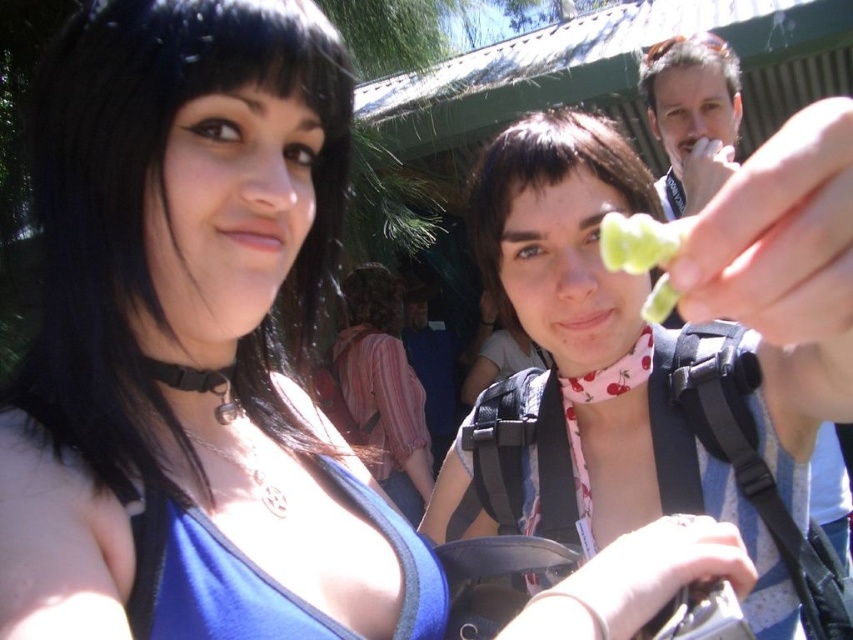
Question: Observing the image, what is the correct spatial positioning of translucent plastic gummy bear at center in reference to green leafy vegetable at center?

Choices:
 (A) below
 (B) above

Answer: (A)

Question: Which point is closer to the camera?

Choices:
 (A) translucent plastic gummy bear at center
 (B) smooth skin face at upper right
 (C) green leafy vegetable at center

Answer: (A)

Question: Does translucent plastic gummy bear at center have a greater width compared to green leafy vegetable at center?

Choices:
 (A) no
 (B) yes

Answer: (B)

Question: Which is farther from the green leafy vegetable at center?

Choices:
 (A) smooth skin face at upper right
 (B) translucent plastic gummy bear at center

Answer: (A)

Question: Among these points, which one is nearest to the camera?

Choices:
 (A) (654, 257)
 (B) (730, 112)
 (C) (618, 461)

Answer: (A)

Question: Does translucent plastic gummy bear at center come behind green leafy vegetable at center?

Choices:
 (A) yes
 (B) no

Answer: (B)